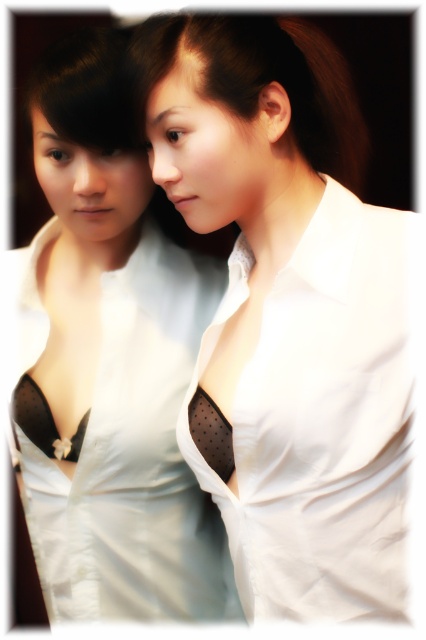
You are standing in front of the image and want to point to the exact location of the white matte shirt at center. According to the coordinates given, where would you point?

The white matte shirt at center is located at the 2D coordinates point (287, 312).

You are standing in front of the image and want to determine which point is closer to you. The points are labeled as point 1 at coordinates point (215, 572) and point 2 at coordinates point (245, 13). Which point is closer to you?

Point (215, 572) is further to the viewer than point (245, 13), so point (245, 13) is closer to you.

You are a photographer adjusting the lighting in a studio. You notice two blouses, the white satin blouse at center and the matte white blouse at center, hanging on a rack in the foreground. Which blouse is closer to the camera lens?

The white satin blouse at center is positioned under the matte white blouse at center, so the matte white blouse at center is closer to the camera lens.